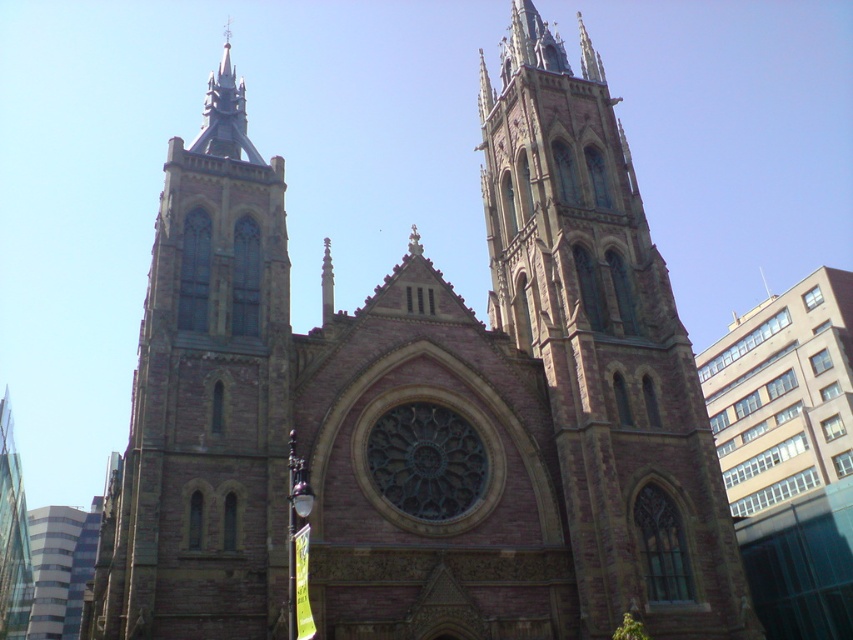
You are standing in front of the grand Gothic church and want to take a photo of the towers. Which tower should you look up more to capture the brown stone tower at center and the brown stone tower at left in your shot?

The brown stone tower at center is below the brown stone tower at left, so you should look up more to include the brown stone tower at left in your photo since it is higher.

You are standing in front of the grand Gothic church and want to take a photo of both brown stone tower at center and brown stone tower at left. Which tower should you position yourself closer to in order to capture both in the same frame?

You should position yourself closer to the brown stone tower at center because the brown stone tower at left is behind the brown stone tower at center, so moving closer to the central tower will help ensure both are visible in the frame.